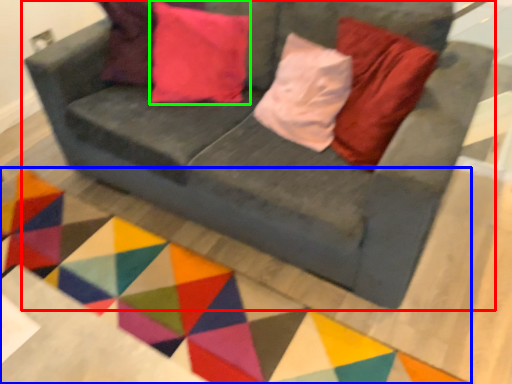
Question: Which is nearer to the studio couch (highlighted by a red box)? mat (highlighted by a blue box) or pillow (highlighted by a green box).

Choices:
 (A) mat
 (B) pillow

Answer: (B)